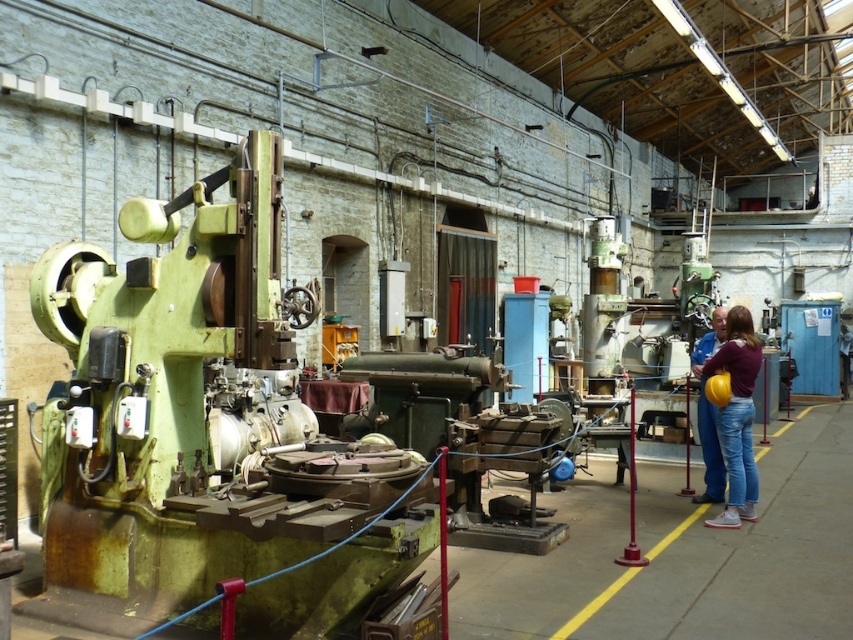
Question: Based on their relative distances, which object is farther from the denim jeans at lower right?

Choices:
 (A) maroon fabric shirt at center
 (B) green metallic machine at left

Answer: (B)

Question: Among these points, which one is nearest to the camera?

Choices:
 (A) (718, 451)
 (B) (735, 401)

Answer: (B)

Question: Can you confirm if green metallic machine at left is positioned above maroon fabric shirt at center?

Choices:
 (A) yes
 (B) no

Answer: (B)

Question: Is green metallic machine at left thinner than maroon fabric shirt at center?

Choices:
 (A) no
 (B) yes

Answer: (A)

Question: Which point is farther to the camera?

Choices:
 (A) maroon fabric shirt at center
 (B) denim jeans at lower right
 (C) green metallic machine at left

Answer: (B)

Question: Does maroon fabric shirt at center come behind denim jeans at lower right?

Choices:
 (A) yes
 (B) no

Answer: (B)